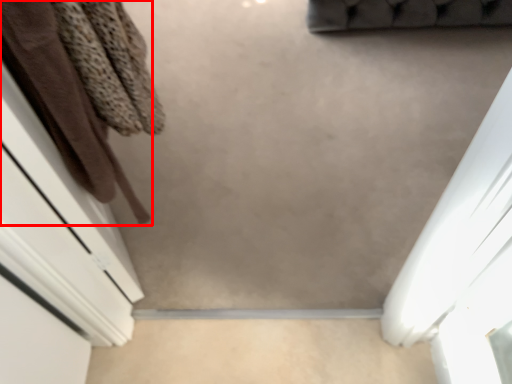
Question: Where is clothing (annotated by the red box) located in relation to concrete in the image?

Choices:
 (A) right
 (B) left

Answer: (B)